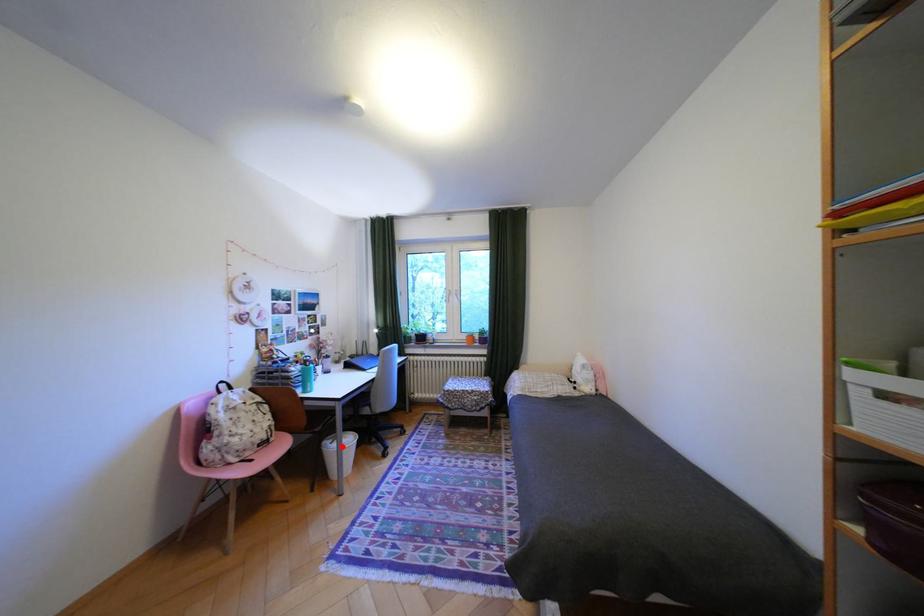
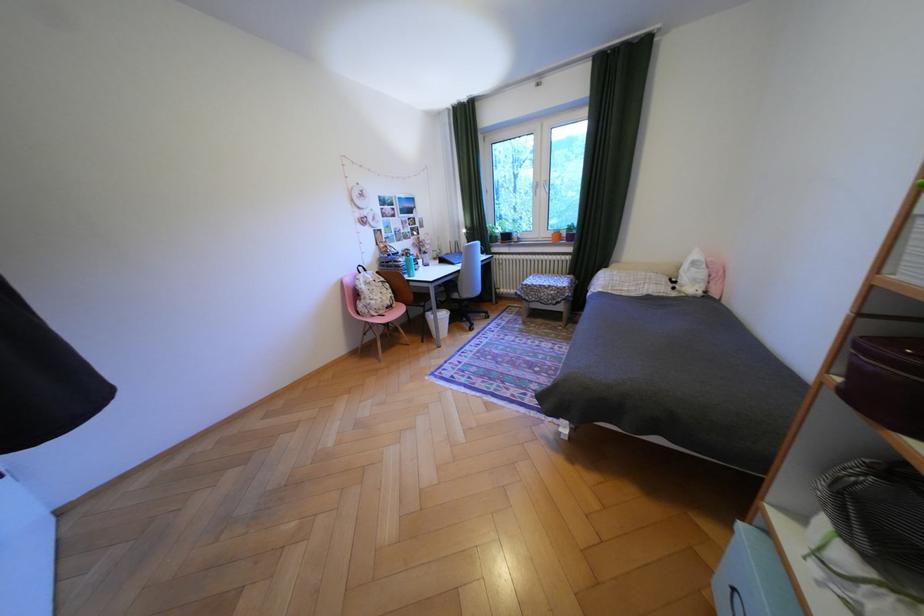
Question: I am providing you with two images of the same scene from different viewpoints. Given a red point in image1, look at the same physical point in image2. Is it:

Choices:
 (A) Closer to the viewpoint
 (B) Farther from the viewpoint

Answer: (A)